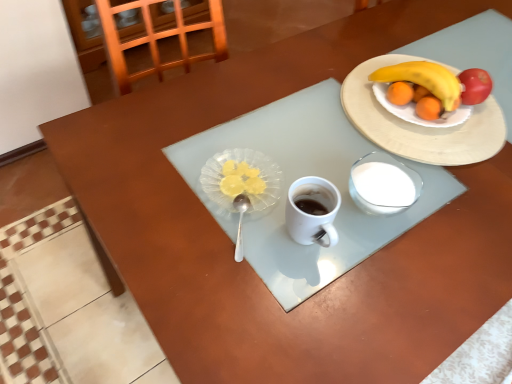
Locate an element on the screen. The height and width of the screenshot is (384, 512). vacant space situated on the left part of translucent glass plate at center is located at coordinates (148, 167).